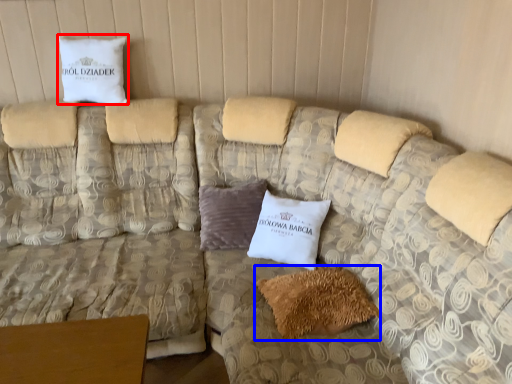
Question: Which point is closer to the camera, pillow (highlighted by a red box) or pillow (highlighted by a blue box)?

Choices:
 (A) pillow
 (B) pillow

Answer: (B)